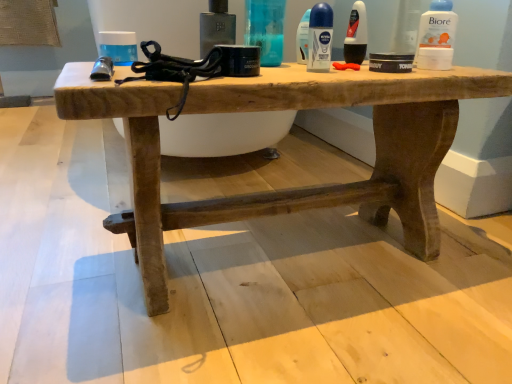
The width and height of the screenshot is (512, 384). In order to click on translucent plastic bottle at upper center, the second toiletry viewed from the right in this screenshot , I will do `click(266, 29)`.

What do you see at coordinates (356, 35) in the screenshot?
I see `matte black deodorant at center, the third toiletry viewed from the left` at bounding box center [356, 35].

How much space does blue glossy deodorant stick at center, positioned as the 2th mouthwash in left-to-right order, occupy horizontally?

The width of blue glossy deodorant stick at center, positioned as the 2th mouthwash in left-to-right order, is 1.79 inches.

The image size is (512, 384). What do you see at coordinates (287, 108) in the screenshot? I see `rustic wood table at center` at bounding box center [287, 108].

What are the coordinates of `white plastic biore at upper right, acting as the first mouthwash starting from the right` in the screenshot? It's located at (436, 36).

Considering the sizes of objects blue matte deodorant at upper center, arranged as the first mouthwash when viewed from the back, and rustic wood table at center in the image provided, who is shorter, blue matte deodorant at upper center, arranged as the first mouthwash when viewed from the back, or rustic wood table at center?

Standing shorter between the two is blue matte deodorant at upper center, arranged as the first mouthwash when viewed from the back.

From the image's perspective, which one is positioned higher, blue matte deodorant at upper center, arranged as the first mouthwash when viewed from the back, or rustic wood table at center?

blue matte deodorant at upper center, arranged as the first mouthwash when viewed from the back, appears higher in the image.

Considering the relative positions of blue matte deodorant at upper center, arranged as the first mouthwash when viewed from the back, and rustic wood table at center in the image provided, is blue matte deodorant at upper center, arranged as the first mouthwash when viewed from the back, to the left of rustic wood table at center from the viewer's perspective?

No.

Which is closer to the camera, (305, 57) or (154, 120)?

The point (154, 120) is in front.

Considering the relative positions of rustic wood table at center and blue glossy deodorant stick at center, placed as the third mouthwash when sorted from back to front, in the image provided, is rustic wood table at center to the left or to the right of blue glossy deodorant stick at center, placed as the third mouthwash when sorted from back to front,?

Based on their positions, rustic wood table at center is located to the left of blue glossy deodorant stick at center, placed as the third mouthwash when sorted from back to front.

Identify the location of table below the blue glossy deodorant stick at center, placed as the third mouthwash when sorted from back to front (from a real-world perspective). (287, 108).

Which is in front, rustic wood table at center or blue glossy deodorant stick at center, placed as the 1th mouthwash when sorted from front to back?

rustic wood table at center is more forward.

Is rustic wood table at center taller than blue glossy deodorant stick at center, placed as the 1th mouthwash when sorted from front to back?

Yes.

The height and width of the screenshot is (384, 512). I want to click on mouthwash above the metallic black toiletry at upper center, the 3th toiletry in the right-to-left sequence (from a real-world perspective), so click(436, 36).

Does metallic black toiletry at upper center, the 3th toiletry in the right-to-left sequence, turn towards white plastic biore at upper right, which is the 2th mouthwash in back-to-front order?

No, metallic black toiletry at upper center, the 3th toiletry in the right-to-left sequence, does not turn towards white plastic biore at upper right, which is the 2th mouthwash in back-to-front order.

In the scene shown: Considering the positions of objects metallic black toiletry at upper center, which is counted as the first toiletry, starting from the left, and white plastic biore at upper right, acting as the first mouthwash starting from the right, in the image provided, who is in front, metallic black toiletry at upper center, which is counted as the first toiletry, starting from the left, or white plastic biore at upper right, acting as the first mouthwash starting from the right,?

metallic black toiletry at upper center, which is counted as the first toiletry, starting from the left, is in front.

Could you tell me if metallic black toiletry at upper center, the 3th toiletry in the right-to-left sequence, is turned towards translucent plastic bottle at upper center, the second toiletry viewed from the right?

No, metallic black toiletry at upper center, the 3th toiletry in the right-to-left sequence, is not oriented towards translucent plastic bottle at upper center, the second toiletry viewed from the right.

Are metallic black toiletry at upper center, the 3th toiletry in the right-to-left sequence, and translucent plastic bottle at upper center, the second toiletry viewed from the right, making contact?

Yes, metallic black toiletry at upper center, the 3th toiletry in the right-to-left sequence, is beside translucent plastic bottle at upper center, the second toiletry viewed from the right.

Is metallic black toiletry at upper center, the 3th toiletry in the right-to-left sequence, taller than translucent plastic bottle at upper center, the second toiletry viewed from the right?

No, metallic black toiletry at upper center, the 3th toiletry in the right-to-left sequence, is not taller than translucent plastic bottle at upper center, the second toiletry viewed from the right.

From a real-world perspective, is metallic black toiletry at upper center, the 3th toiletry in the right-to-left sequence, located beneath translucent plastic bottle at upper center, which is the second toiletry from left to right?

Yes, from a real-world perspective, metallic black toiletry at upper center, the 3th toiletry in the right-to-left sequence, is under translucent plastic bottle at upper center, which is the second toiletry from left to right.

Is blue matte deodorant at upper center, which is the 3th mouthwash from front to back, closer to camera compared to blue glossy deodorant stick at center, the second mouthwash from the right?

No, blue matte deodorant at upper center, which is the 3th mouthwash from front to back, is further to the viewer.

Is blue matte deodorant at upper center, acting as the third mouthwash starting from the right, wider than blue glossy deodorant stick at center, placed as the third mouthwash when sorted from back to front?

Incorrect, the width of blue matte deodorant at upper center, acting as the third mouthwash starting from the right, does not surpass that of blue glossy deodorant stick at center, placed as the third mouthwash when sorted from back to front.

Can you confirm if blue matte deodorant at upper center, which is the 3th mouthwash from front to back, is taller than blue glossy deodorant stick at center, placed as the 1th mouthwash when sorted from front to back?

Correct, blue matte deodorant at upper center, which is the 3th mouthwash from front to back, is much taller as blue glossy deodorant stick at center, placed as the 1th mouthwash when sorted from front to back.

Does blue glossy deodorant stick at center, positioned as the 2th mouthwash in left-to-right order, have a smaller size compared to rustic wood table at center?

Correct, blue glossy deodorant stick at center, positioned as the 2th mouthwash in left-to-right order, occupies less space than rustic wood table at center.

Considering the sizes of objects blue glossy deodorant stick at center, the second mouthwash from the right, and rustic wood table at center in the image provided, who is shorter, blue glossy deodorant stick at center, the second mouthwash from the right, or rustic wood table at center?

Standing shorter between the two is blue glossy deodorant stick at center, the second mouthwash from the right.

Which object is wider, blue glossy deodorant stick at center, placed as the third mouthwash when sorted from back to front, or rustic wood table at center?

With larger width is rustic wood table at center.

Looking at this image, is blue glossy deodorant stick at center, the second mouthwash from the right, positioned before rustic wood table at center?

No, it is not.

Does point (434, 42) lie behind point (215, 2)?

That is True.

Can you confirm if white plastic biore at upper right, which is counted as the second mouthwash, starting from the front, is positioned to the left of metallic black toiletry at upper center, the 3th toiletry in the right-to-left sequence?

Incorrect, white plastic biore at upper right, which is counted as the second mouthwash, starting from the front, is not on the left side of metallic black toiletry at upper center, the 3th toiletry in the right-to-left sequence.

Is white plastic biore at upper right, acting as the first mouthwash starting from the right, positioned before metallic black toiletry at upper center, the 3th toiletry in the right-to-left sequence?

No, it is behind metallic black toiletry at upper center, the 3th toiletry in the right-to-left sequence.

From the image's perspective, which one is positioned lower, white plastic biore at upper right, which is counted as the second mouthwash, starting from the front, or metallic black toiletry at upper center, the 3th toiletry in the right-to-left sequence?

metallic black toiletry at upper center, the 3th toiletry in the right-to-left sequence, appears lower in the image.

This screenshot has height=384, width=512. Identify the location of table in front of the blue matte deodorant at upper center, which is the 3th mouthwash from front to back. (287, 108).

At what (x,y) coordinates should I click in order to perform the action: click on the 1st mouthwash behind the rustic wood table at center, starting your count from the anchor. Please return your answer as a coordinate pair (x, y). The height and width of the screenshot is (384, 512). Looking at the image, I should click on (320, 38).

Considering their positions, is rustic wood table at center positioned closer to translucent plastic bottle at upper center, which is the second toiletry from left to right, than blue matte deodorant at upper center, acting as the third mouthwash starting from the right?

Based on the image, blue matte deodorant at upper center, acting as the third mouthwash starting from the right, appears to be nearer to translucent plastic bottle at upper center, which is the second toiletry from left to right.

Estimate the real-world distances between objects in this image. Which object is further from blue matte deodorant at upper center, the 1th mouthwash when ordered from left to right, rustic wood table at center or matte black deodorant at center, the third toiletry viewed from the left?

Based on the image, rustic wood table at center appears to be further to blue matte deodorant at upper center, the 1th mouthwash when ordered from left to right.

Consider the image. Looking at the image, which one is located further to metallic black toiletry at upper center, the 3th toiletry in the right-to-left sequence, matte black deodorant at center, the third toiletry viewed from the left, or translucent plastic bottle at upper center, which is the second toiletry from left to right?

Among the two, matte black deodorant at center, the third toiletry viewed from the left, is located further to metallic black toiletry at upper center, the 3th toiletry in the right-to-left sequence.

From the image, which object appears to be nearer to white plastic biore at upper right, which is the 2th mouthwash in back-to-front order, matte black deodorant at center, the third toiletry viewed from the left, or blue glossy deodorant stick at center, placed as the 1th mouthwash when sorted from front to back?

matte black deodorant at center, the third toiletry viewed from the left, is positioned closer to the anchor white plastic biore at upper right, which is the 2th mouthwash in back-to-front order.

Based on their spatial positions, is translucent plastic bottle at upper center, which is the second toiletry from left to right, or metallic black toiletry at upper center, which is counted as the first toiletry, starting from the left, further from blue matte deodorant at upper center, arranged as the first mouthwash when viewed from the back?

metallic black toiletry at upper center, which is counted as the first toiletry, starting from the left, is positioned further to the anchor blue matte deodorant at upper center, arranged as the first mouthwash when viewed from the back.

Estimate the real-world distances between objects in this image. Which object is closer to white plastic biore at upper right, which appears as the 3th mouthwash when viewed from the left, metallic black toiletry at upper center, which is counted as the first toiletry, starting from the left, or blue matte deodorant at upper center, acting as the third mouthwash starting from the right?

Among the two, blue matte deodorant at upper center, acting as the third mouthwash starting from the right, is located nearer to white plastic biore at upper right, which appears as the 3th mouthwash when viewed from the left.

Estimate the real-world distances between objects in this image. Which object is closer to rustic wood table at center, blue glossy deodorant stick at center, positioned as the 2th mouthwash in left-to-right order, or translucent plastic bottle at upper center, which is the second toiletry from left to right?

blue glossy deodorant stick at center, positioned as the 2th mouthwash in left-to-right order.

From the image, which object appears to be farther from matte black deodorant at center, the third toiletry viewed from the left, metallic black toiletry at upper center, the 3th toiletry in the right-to-left sequence, or translucent plastic bottle at upper center, the second toiletry viewed from the right?

metallic black toiletry at upper center, the 3th toiletry in the right-to-left sequence.

At what (x,y) coordinates should I click in order to perform the action: click on table between metallic black toiletry at upper center, which is counted as the first toiletry, starting from the left, and white plastic biore at upper right, which appears as the 3th mouthwash when viewed from the left. Please return your answer as a coordinate pair (x, y). This screenshot has width=512, height=384. Looking at the image, I should click on (287, 108).

You are a GUI agent. You are given a task and a screenshot of the screen. Output one action in this format:
    pyautogui.click(x=<x>, y=<y>)
    Task: Click on the toiletry situated between blue matte deodorant at upper center, which is the 3th mouthwash from front to back, and white plastic biore at upper right, which is the 2th mouthwash in back-to-front order, from left to right
    
    Given the screenshot: What is the action you would take?
    pyautogui.click(x=356, y=35)

The width and height of the screenshot is (512, 384). Identify the location of toiletry between blue glossy deodorant stick at center, placed as the 1th mouthwash when sorted from front to back, and white plastic biore at upper right, which is counted as the second mouthwash, starting from the front, from left to right. (356, 35).

You are a GUI agent. You are given a task and a screenshot of the screen. Output one action in this format:
    pyautogui.click(x=<x>, y=<y>)
    Task: Click on the mouthwash situated between blue matte deodorant at upper center, acting as the third mouthwash starting from the right, and white plastic biore at upper right, which appears as the 3th mouthwash when viewed from the left, from left to right
    The width and height of the screenshot is (512, 384).
    Given the screenshot: What is the action you would take?
    pyautogui.click(x=320, y=38)